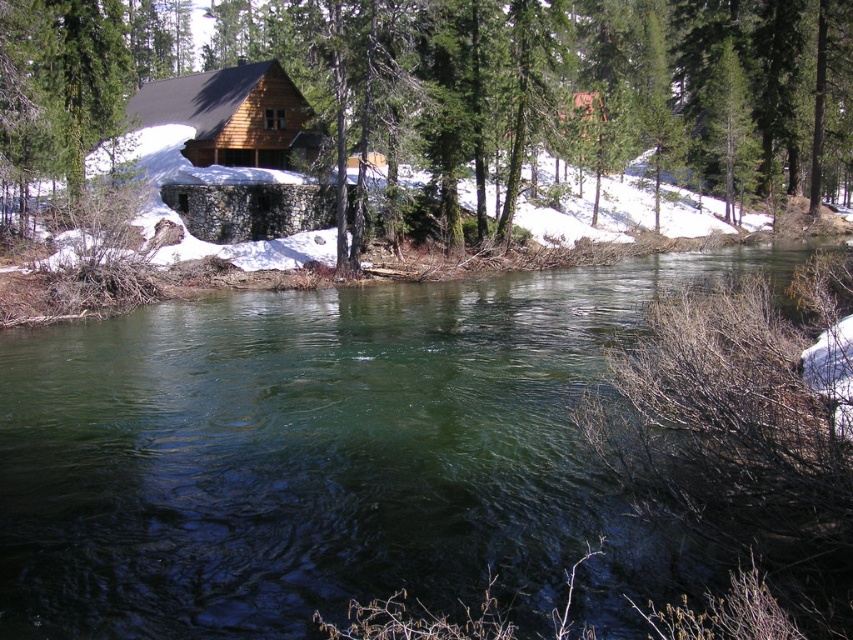
Question: Observing the image, what is the correct spatial positioning of green translucent water at center in reference to matte wood cabin at center?

Choices:
 (A) below
 (B) above

Answer: (A)

Question: Which point is closer to the camera?

Choices:
 (A) (206, 154)
 (B) (456, 161)

Answer: (B)

Question: Is green translucent water at center above matte wood cabin at center?

Choices:
 (A) yes
 (B) no

Answer: (B)

Question: Which is farther from the green leafy tree at upper center?

Choices:
 (A) green translucent water at center
 (B) matte wood cabin at center

Answer: (A)

Question: Based on their relative distances, which object is farther from the green translucent water at center?

Choices:
 (A) matte wood cabin at center
 (B) green leafy tree at upper center

Answer: (B)

Question: Does green translucent water at center appear under green leafy tree at upper center?

Choices:
 (A) no
 (B) yes

Answer: (B)